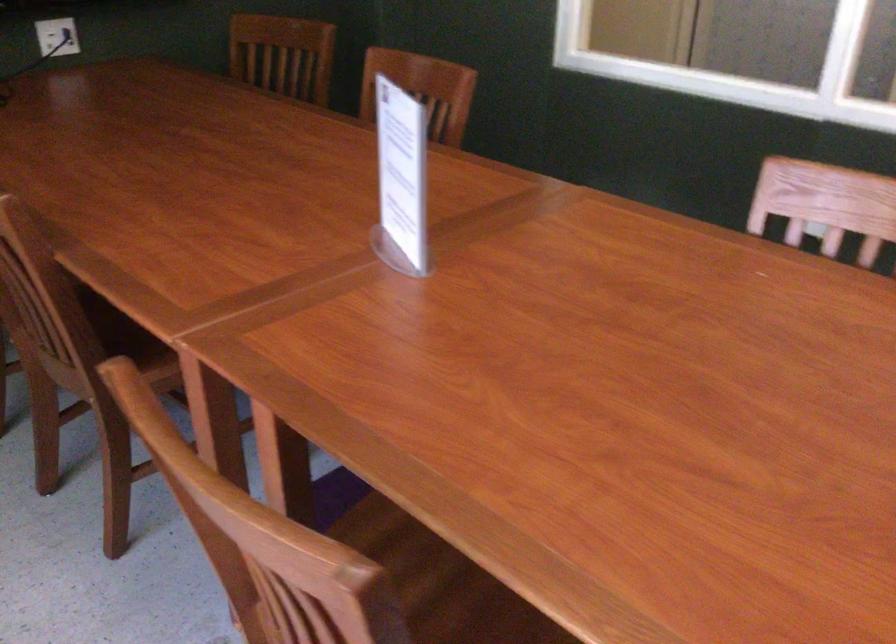
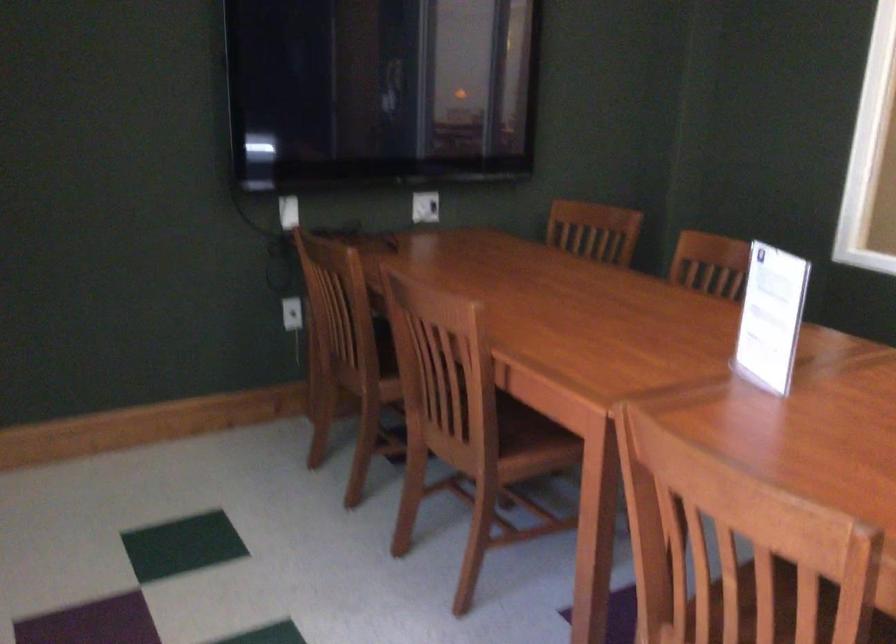
Question: Based on the continuous images, in which direction is the camera rotating? Reply with the corresponding letter.

Choices:
 (A) Left
 (B) Right
 (C) Up
 (D) Down

Answer: (A)